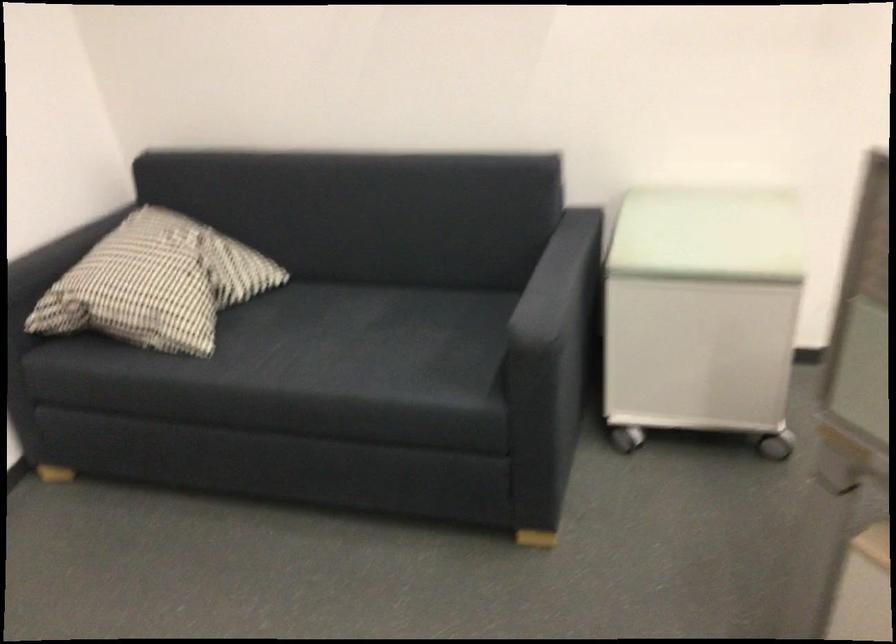
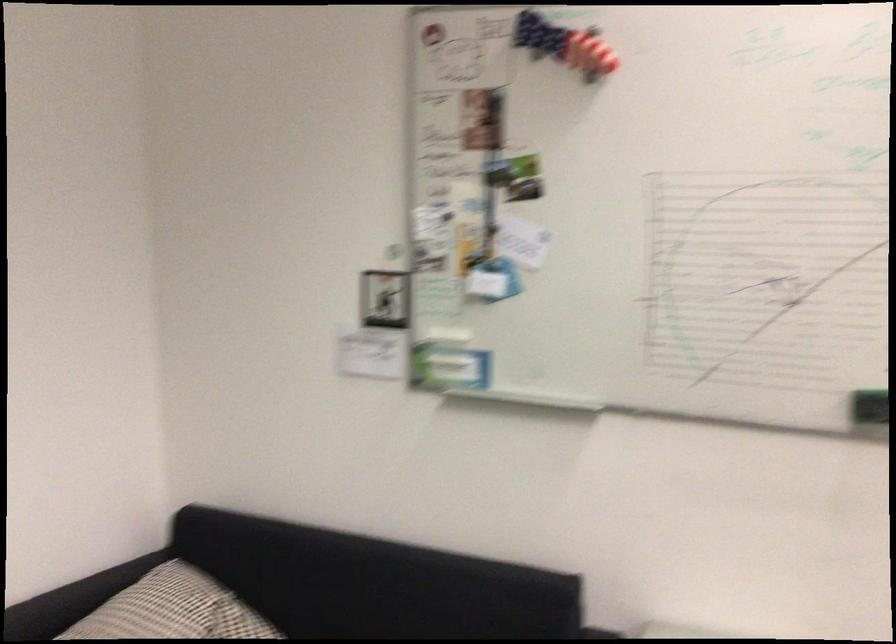
Locate, in the second image, the point that corresponds to [182,248] in the first image.

(193, 612)